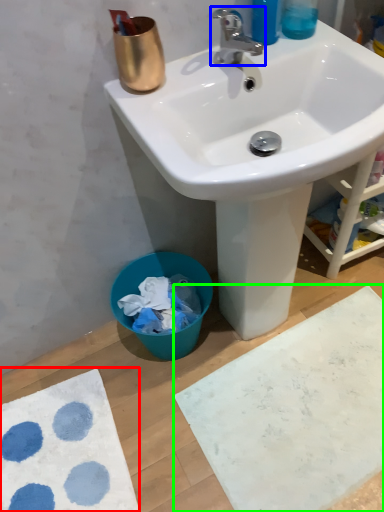
Question: Based on their relative distances, which object is nearer to bath mat (highlighted by a red box)? Choose from tap (highlighted by a blue box) and bath mat (highlighted by a green box).

Choices:
 (A) tap
 (B) bath mat

Answer: (B)